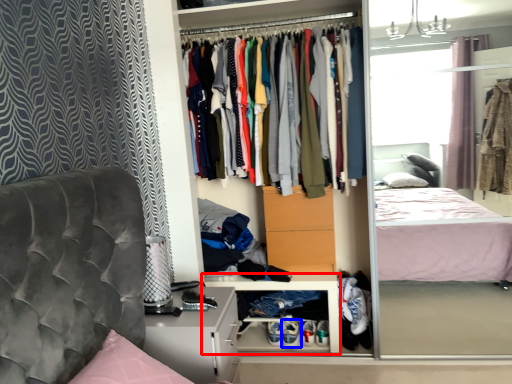
Question: Among these objects, which one is farthest to the camera, cabinet (highlighted by a red box) or footwear (highlighted by a blue box)?

Choices:
 (A) cabinet
 (B) footwear

Answer: (B)